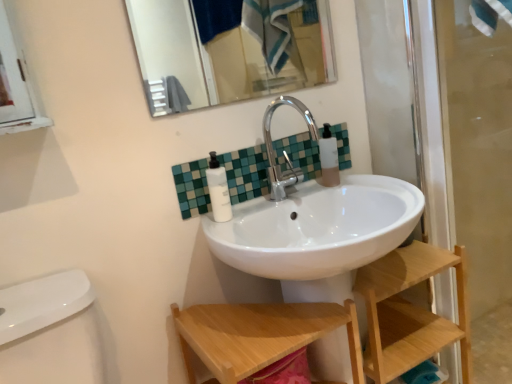
Question: Can you confirm if metallic silver mirror at upper center is positioned to the right of white matte pump bottle at center, which ranks as the first toiletry in left-to-right order?

Choices:
 (A) no
 (B) yes

Answer: (B)

Question: Is metallic silver mirror at upper center looking in the opposite direction of white matte pump bottle at center, which appears as the 1th toiletry when viewed from the front?

Choices:
 (A) yes
 (B) no

Answer: (B)

Question: Considering the relative sizes of metallic silver mirror at upper center and white matte pump bottle at center, positioned as the 2th toiletry in right-to-left order, in the image provided, is metallic silver mirror at upper center smaller than white matte pump bottle at center, positioned as the 2th toiletry in right-to-left order,?

Choices:
 (A) yes
 (B) no

Answer: (B)

Question: From the image's perspective, is metallic silver mirror at upper center above white matte pump bottle at center, which ranks as the first toiletry in left-to-right order?

Choices:
 (A) no
 (B) yes

Answer: (B)

Question: Is there a large distance between metallic silver mirror at upper center and white matte pump bottle at center, arranged as the second toiletry when viewed from the back?

Choices:
 (A) yes
 (B) no

Answer: (A)

Question: Considering the relative positions of metallic silver mirror at upper center and white matte pump bottle at center, positioned as the 2th toiletry in right-to-left order, in the image provided, is metallic silver mirror at upper center behind white matte pump bottle at center, positioned as the 2th toiletry in right-to-left order,?

Choices:
 (A) yes
 (B) no

Answer: (B)

Question: Is the surface of translucent plastic bottle at upper right, which is counted as the 2th toiletry, starting from the left, in direct contact with silver metallic faucet at center?

Choices:
 (A) yes
 (B) no

Answer: (B)

Question: Does translucent plastic bottle at upper right, placed as the first toiletry when sorted from right to left, have a larger size compared to silver metallic faucet at center?

Choices:
 (A) yes
 (B) no

Answer: (B)

Question: From a real-world perspective, is translucent plastic bottle at upper right, which is counted as the 2th toiletry, starting from the left, on silver metallic faucet at center?

Choices:
 (A) yes
 (B) no

Answer: (B)

Question: From the image's perspective, is translucent plastic bottle at upper right, which is counted as the 2th toiletry, starting from the left, under silver metallic faucet at center?

Choices:
 (A) no
 (B) yes

Answer: (A)

Question: Does translucent plastic bottle at upper right, placed as the first toiletry when sorted from right to left, have a smaller size compared to silver metallic faucet at center?

Choices:
 (A) yes
 (B) no

Answer: (A)

Question: From the image's perspective, is translucent plastic bottle at upper right, the second toiletry when ordered from front to back, over silver metallic faucet at center?

Choices:
 (A) yes
 (B) no

Answer: (A)

Question: Is wooden step stool at lower center a part of metallic silver mirror at upper center?

Choices:
 (A) yes
 (B) no

Answer: (B)